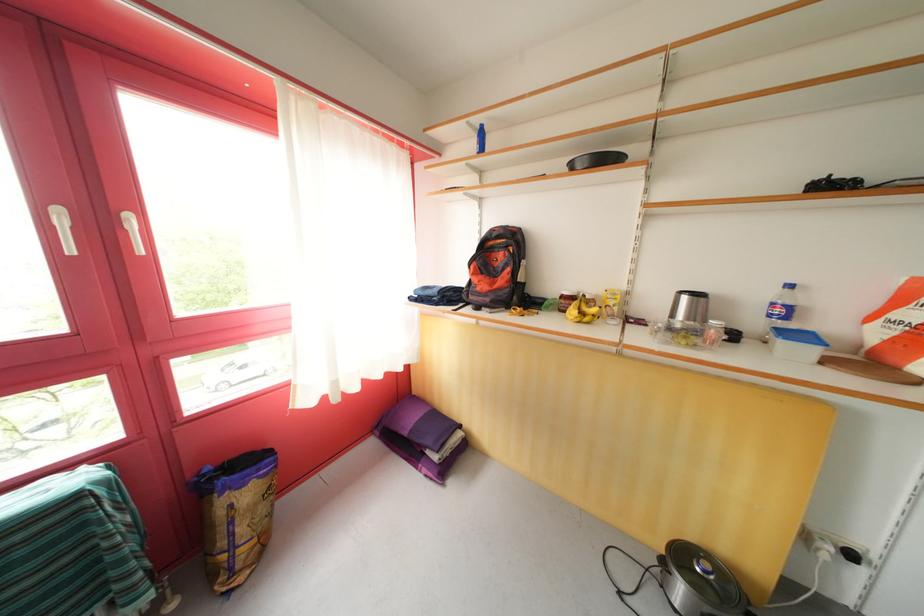
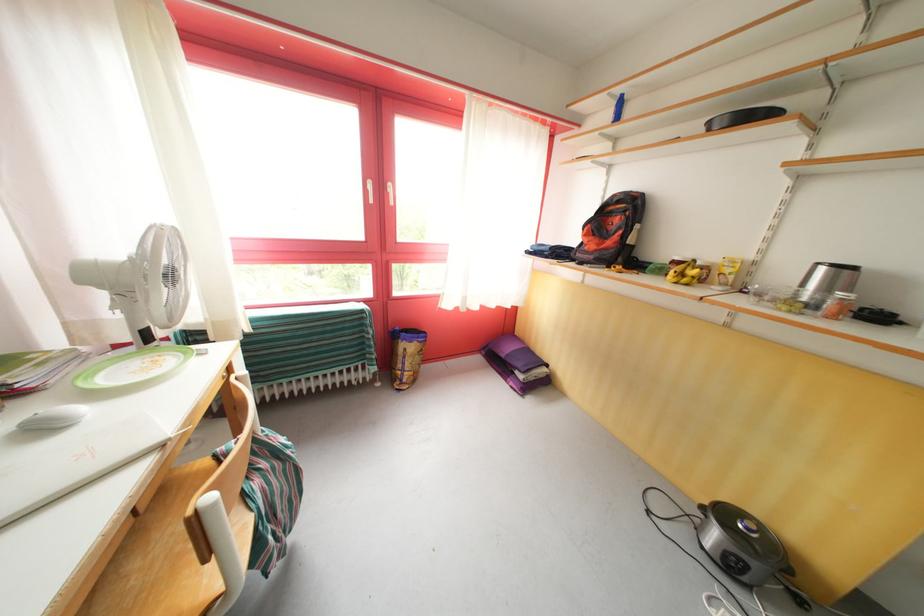
Question: How did the camera likely rotate?

Choices:
 (A) Left
 (B) Right
 (C) Up
 (D) Down

Answer: (A)